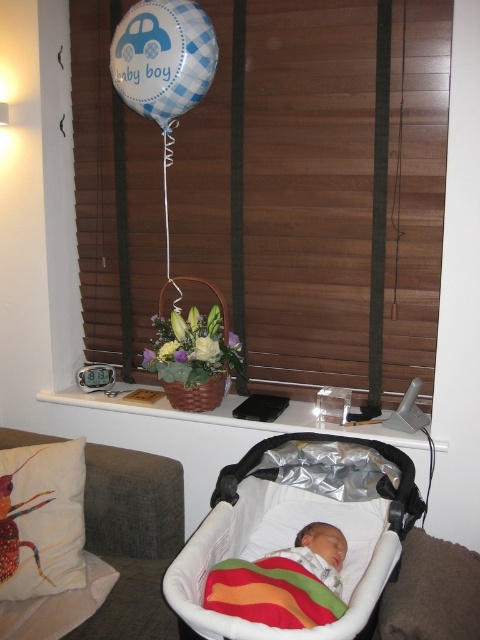
Is point (374, 602) less distant than point (299, 605)?

Yes, it is.

Does white fabric baby carriage at lower center lie in front of rainbow striped fabric at center?

Yes, white fabric baby carriage at lower center is in front of rainbow striped fabric at center.

Describe the element at coordinates (256, 525) in the screenshot. I see `white fabric baby carriage at lower center` at that location.

Identify the location of white fabric baby carriage at lower center. (256, 525).

Can you confirm if white fabric cushion with colorful insect design at lower left is taller than blue checkered balloon at upper center?

Incorrect, white fabric cushion with colorful insect design at lower left's height is not larger of blue checkered balloon at upper center's.

Does white fabric cushion with colorful insect design at lower left have a lesser height compared to blue checkered balloon at upper center?

Indeed, white fabric cushion with colorful insect design at lower left has a lesser height compared to blue checkered balloon at upper center.

Which is in front, point (14, 497) or point (162, 3)?

Point (14, 497) is in front.

Locate an element on the screen. white fabric cushion with colorful insect design at lower left is located at coordinates (41, 518).

Who is positioned more to the left, white fabric cushion with colorful insect design at lower left or rainbow striped fabric at center?

white fabric cushion with colorful insect design at lower left is more to the left.

Does point (27, 568) lie behind point (334, 602)?

That is True.

Is point (32, 508) closer to viewer compared to point (262, 616)?

No, it is behind (262, 616).

At what (x,y) coordinates should I click in order to perform the action: click on white fabric cushion with colorful insect design at lower left. Please return your answer as a coordinate pair (x, y). This screenshot has height=640, width=480. Looking at the image, I should click on (41, 518).